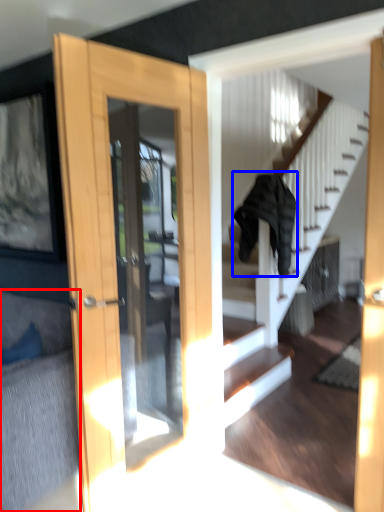
Question: Among these objects, which one is farthest to the camera, couch (highlighted by a red box) or clothing (highlighted by a blue box)?

Choices:
 (A) couch
 (B) clothing

Answer: (B)